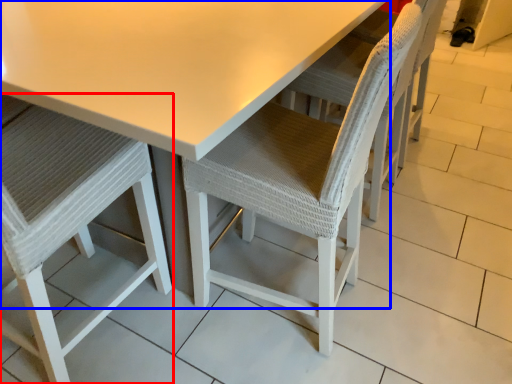
Question: Which object is closer to the camera taking this photo, chair (highlighted by a red box) or table (highlighted by a blue box)?

Choices:
 (A) chair
 (B) table

Answer: (A)